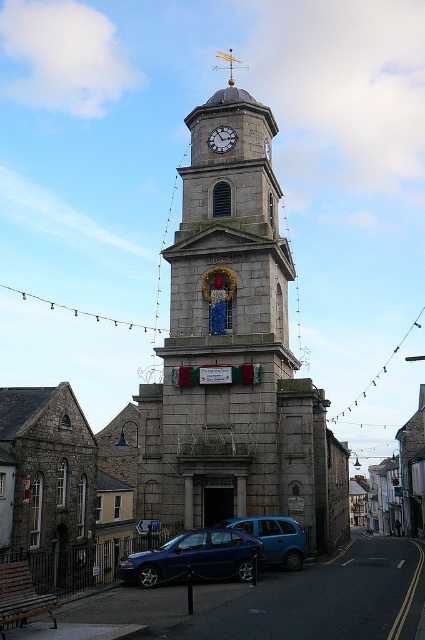
Which is below, stone clock tower at center or blue matte van at center?

blue matte van at center is lower down.

Is stone clock tower at center above blue matte van at center?

Correct, stone clock tower at center is located above blue matte van at center.

Is point (234, 426) positioned after point (243, 525)?

Yes, it is behind point (243, 525).

Identify the location of stone clock tower at center. The image size is (425, 640). (235, 353).

Does metallic blue sedan at center appear over white stone clock at center?

No.

Is point (197, 531) closer to viewer compared to point (209, 140)?

That is True.

Is point (248, 572) farther from viewer compared to point (226, 134)?

No, (248, 572) is closer to viewer.

Image resolution: width=425 pixels, height=640 pixels. What are the coordinates of `metallic blue sedan at center` in the screenshot? It's located at (193, 557).

Between metallic blue sedan at center and blue matte van at center, which one appears on the right side from the viewer's perspective?

blue matte van at center is more to the right.

Who is more distant from viewer, (240, 556) or (294, 536)?

The point (294, 536) is behind.

Who is more forward, (227, 534) or (291, 561)?

Point (227, 534)

The width and height of the screenshot is (425, 640). Find the location of `metallic blue sedan at center`. metallic blue sedan at center is located at coordinates (193, 557).